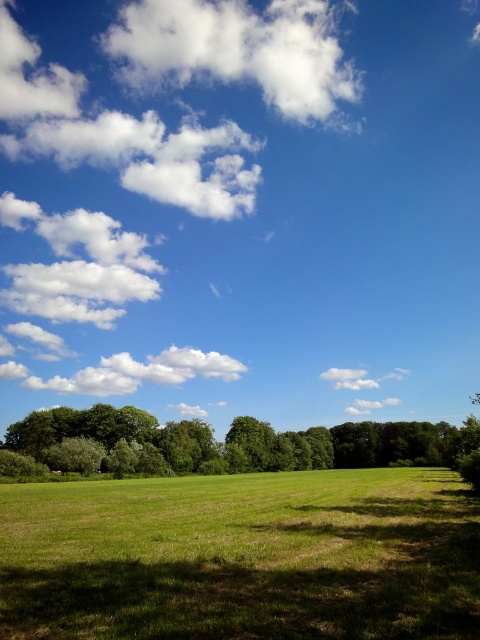
Between point (181, 230) and point (311, 435), which one is positioned behind?

Point (181, 230)

Is blue sky at upper center positioned behind green leafy tree at lower left?

That is True.

What do you see at coordinates (240, 205) in the screenshot?
I see `blue sky at upper center` at bounding box center [240, 205].

Locate an element on the screen. This screenshot has width=480, height=640. blue sky at upper center is located at coordinates (240, 205).

Which is behind, point (446, 497) or point (274, 449)?

Positioned behind is point (274, 449).

Does point (190, 625) come in front of point (239, 417)?

Yes, it is in front of point (239, 417).

Locate an element on the screen. The width and height of the screenshot is (480, 640). green grassy field at center is located at coordinates (242, 557).

Is blue sky at upper center further to the viewer compared to white fluffy cloud at upper left?

No, it is in front of white fluffy cloud at upper left.

Who is higher up, blue sky at upper center or white fluffy cloud at upper left?

white fluffy cloud at upper left

The image size is (480, 640). What do you see at coordinates (240, 205) in the screenshot?
I see `blue sky at upper center` at bounding box center [240, 205].

The height and width of the screenshot is (640, 480). Identify the location of blue sky at upper center. (240, 205).